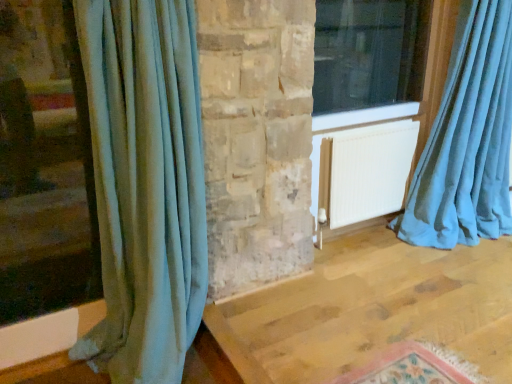
Question: Is velvet teal curtain at left, the first curtain from the left, wider than white matte radiator at center?

Choices:
 (A) yes
 (B) no

Answer: (B)

Question: Is velvet teal curtain at left, which ranks as the second curtain in right-to-left order, at the left side of white matte radiator at center?

Choices:
 (A) no
 (B) yes

Answer: (B)

Question: Is velvet teal curtain at left, the first curtain from the left, completely or partially outside of white matte radiator at center?

Choices:
 (A) no
 (B) yes

Answer: (B)

Question: From the image's perspective, does velvet teal curtain at left, which ranks as the second curtain in right-to-left order, appear lower than white matte radiator at center?

Choices:
 (A) no
 (B) yes

Answer: (B)

Question: Is velvet teal curtain at left, the first curtain from the left, at the right side of white matte radiator at center?

Choices:
 (A) yes
 (B) no

Answer: (B)

Question: In the image, is teal velvet curtain at right, the first curtain when ordered from right to left, on the left side or the right side of velvet teal curtain at left, the first curtain from the left?

Choices:
 (A) right
 (B) left

Answer: (A)

Question: Is teal velvet curtain at right, acting as the second curtain starting from the left, situated inside velvet teal curtain at left, which ranks as the second curtain in right-to-left order, or outside?

Choices:
 (A) inside
 (B) outside

Answer: (B)

Question: Does point (458, 145) appear closer or farther from the camera than point (141, 79)?

Choices:
 (A) farther
 (B) closer

Answer: (A)

Question: Considering their positions, is teal velvet curtain at right, acting as the second curtain starting from the left, located in front of or behind velvet teal curtain at left, which ranks as the second curtain in right-to-left order?

Choices:
 (A) behind
 (B) front

Answer: (A)

Question: Would you say teal velvet curtain at right, the first curtain when ordered from right to left, is inside or outside transparent glass window at upper right?

Choices:
 (A) inside
 (B) outside

Answer: (B)

Question: Considering the relative positions of teal velvet curtain at right, the first curtain when ordered from right to left, and transparent glass window at upper right in the image provided, is teal velvet curtain at right, the first curtain when ordered from right to left, to the left or to the right of transparent glass window at upper right?

Choices:
 (A) right
 (B) left

Answer: (A)

Question: In terms of height, does teal velvet curtain at right, the first curtain when ordered from right to left, look taller or shorter compared to transparent glass window at upper right?

Choices:
 (A) tall
 (B) short

Answer: (A)

Question: From a real-world perspective, is teal velvet curtain at right, acting as the second curtain starting from the left, physically located above or below transparent glass window at upper right?

Choices:
 (A) below
 (B) above

Answer: (A)

Question: In the image, is velvet teal curtain at left, which ranks as the second curtain in right-to-left order, positioned in front of or behind teal velvet curtain at right, acting as the second curtain starting from the left?

Choices:
 (A) behind
 (B) front

Answer: (B)

Question: Considering the positions of velvet teal curtain at left, which ranks as the second curtain in right-to-left order, and teal velvet curtain at right, the first curtain when ordered from right to left, in the image, is velvet teal curtain at left, which ranks as the second curtain in right-to-left order, taller or shorter than teal velvet curtain at right, the first curtain when ordered from right to left,?

Choices:
 (A) tall
 (B) short

Answer: (A)